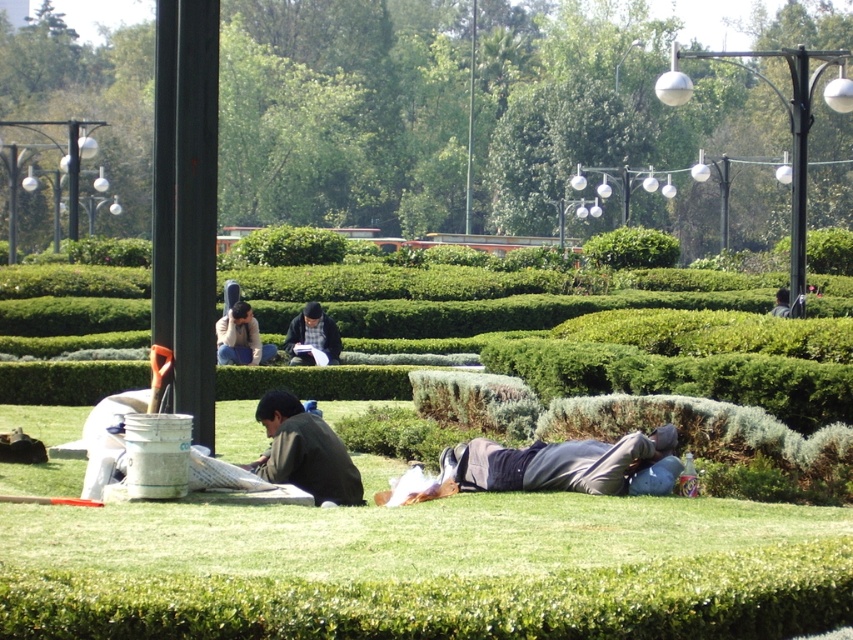
Is dark gray sweater at lower center smaller than dark gray sweater at center?

Yes.

From the picture: Can you confirm if dark gray sweater at lower center is bigger than dark gray sweater at center?

No.

Between point (323, 454) and point (332, 353), which one is positioned behind?

Positioned behind is point (332, 353).

You are a GUI agent. You are given a task and a screenshot of the screen. Output one action in this format:
    pyautogui.click(x=<x>, y=<y>)
    Task: Click on the dark gray sweater at lower center
    
    Given the screenshot: What is the action you would take?
    pyautogui.click(x=305, y=452)

Can you confirm if green grass at lower center is taller than green leafy bush at center?

In fact, green grass at lower center may be shorter than green leafy bush at center.

Does point (424, 608) lie behind point (634, 227)?

That is False.

Image resolution: width=853 pixels, height=640 pixels. What do you see at coordinates (425, 568) in the screenshot? I see `green grass at lower center` at bounding box center [425, 568].

At what (x,y) coordinates should I click in order to perform the action: click on green grass at lower center. Please return your answer as a coordinate pair (x, y). Looking at the image, I should click on (425, 568).

Is matte black jacket at center below dark gray sweater at center?

Yes, matte black jacket at center is below dark gray sweater at center.

In the scene shown: Who is more distant from viewer, (x=250, y=362) or (x=318, y=323)?

The point (x=318, y=323) is behind.

The height and width of the screenshot is (640, 853). What do you see at coordinates (241, 337) in the screenshot? I see `matte black jacket at center` at bounding box center [241, 337].

This screenshot has width=853, height=640. What are the coordinates of `matte black jacket at center` in the screenshot? It's located at (241, 337).